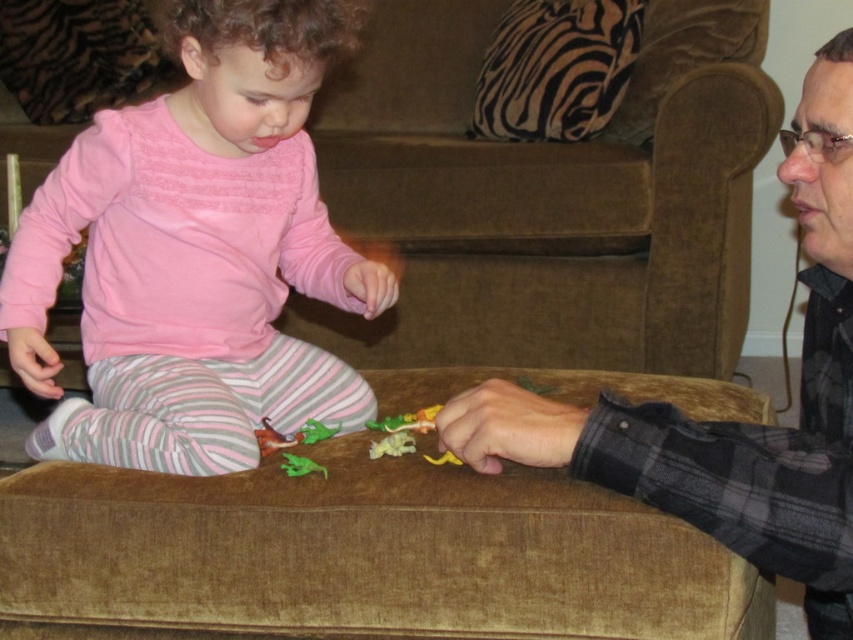
Question: From the image, what is the correct spatial relationship of pink soft fabric toddler at lower left in relation to matte black shirt at lower right?

Choices:
 (A) left
 (B) right

Answer: (A)

Question: Among these objects, which one is farthest from the camera?

Choices:
 (A) matte black shirt at lower right
 (B) pink soft fabric toddler at lower left

Answer: (B)

Question: Is pink soft fabric toddler at lower left positioned at the back of matte black shirt at lower right?

Choices:
 (A) no
 (B) yes

Answer: (B)

Question: Is pink soft fabric toddler at lower left bigger than matte black shirt at lower right?

Choices:
 (A) yes
 (B) no

Answer: (A)